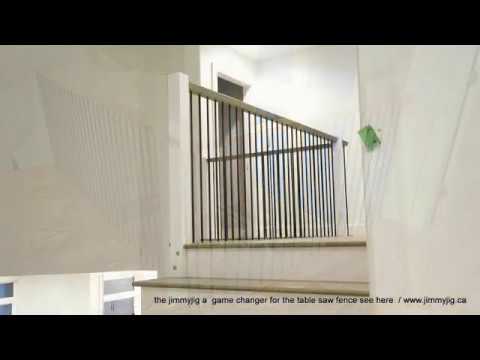
Locate an element on the screen. The image size is (480, 360). painted white walls is located at coordinates (64, 126), (320, 96), (418, 130).